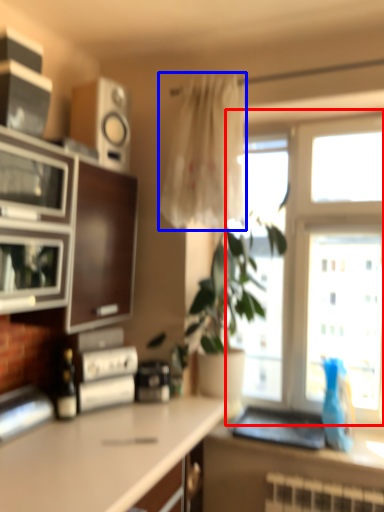
Question: Which of the following is the closest to the observer, window (highlighted by a red box) or curtain (highlighted by a blue box)?

Choices:
 (A) window
 (B) curtain

Answer: (B)